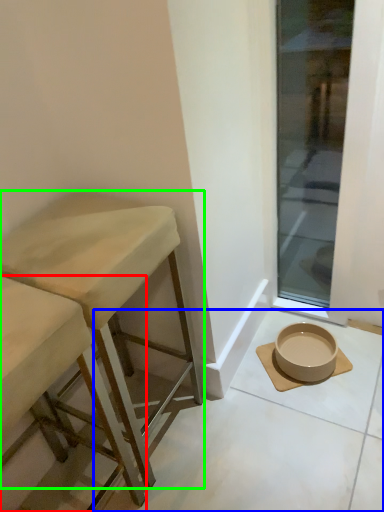
Question: Estimate the real-world distances between objects in this image. Which object is closer to stool (highlighted by a red box), concrete (highlighted by a blue box) or stool (highlighted by a green box)?

Choices:
 (A) concrete
 (B) stool

Answer: (B)